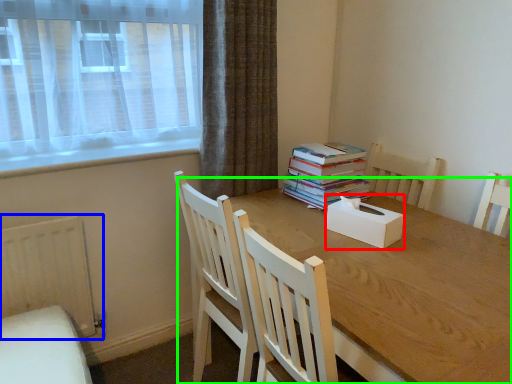
Question: Which object is positioned closest to box (highlighted by a red box)? Select from radiator (highlighted by a blue box) and round table (highlighted by a green box).

Choices:
 (A) radiator
 (B) round table

Answer: (B)